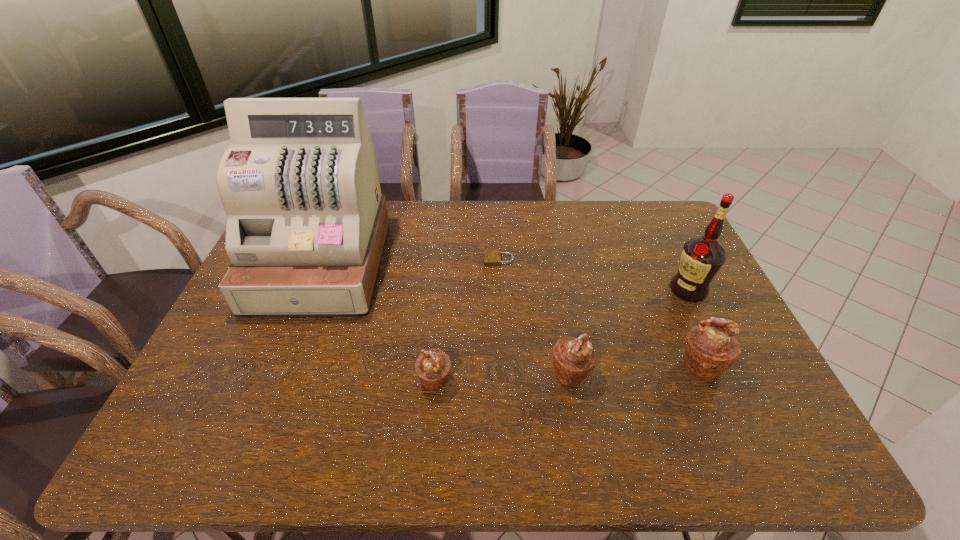
Image resolution: width=960 pixels, height=540 pixels. What are the coordinates of `free space located on the right of the shortest muffin` in the screenshot? It's located at (527, 381).

Where is `vacant space situated 0.170m on the left of the second tallest muffin`? The height and width of the screenshot is (540, 960). vacant space situated 0.170m on the left of the second tallest muffin is located at coordinates (484, 373).

I want to click on vacant space located on the back of the rightmost muffin, so click(x=655, y=261).

Where is `free spot located on the keyhole side of the padlock`? Image resolution: width=960 pixels, height=540 pixels. free spot located on the keyhole side of the padlock is located at coordinates (454, 260).

Locate an element on the screen. free space located 0.160m on the keyhole side of the padlock is located at coordinates pyautogui.click(x=436, y=260).

Where is `free space located on the keyhole side of the padlock`? free space located on the keyhole side of the padlock is located at coordinates [412, 260].

Where is `vacant space positioned 0.160m on the operating side of the leftmost object`? vacant space positioned 0.160m on the operating side of the leftmost object is located at coordinates [x=281, y=364].

Where is `vacant space located 0.220m on the label of the fifth shortest object`? Image resolution: width=960 pixels, height=540 pixels. vacant space located 0.220m on the label of the fifth shortest object is located at coordinates (598, 290).

Locate an element on the screen. free space located on the label of the fifth shortest object is located at coordinates (643, 290).

The width and height of the screenshot is (960, 540). I want to click on vacant region located 0.180m on the label of the fifth shortest object, so click(612, 290).